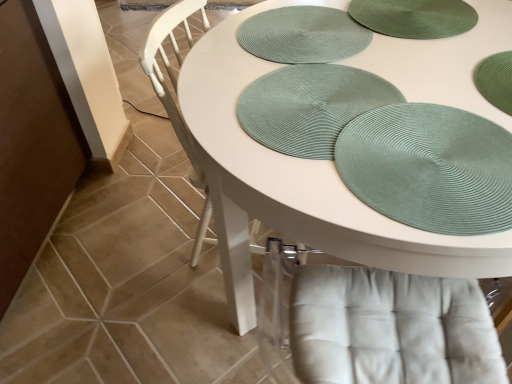
What are the coordinates of `free area in between white textured chair at center and white matte table at center` in the screenshot? It's located at (187, 318).